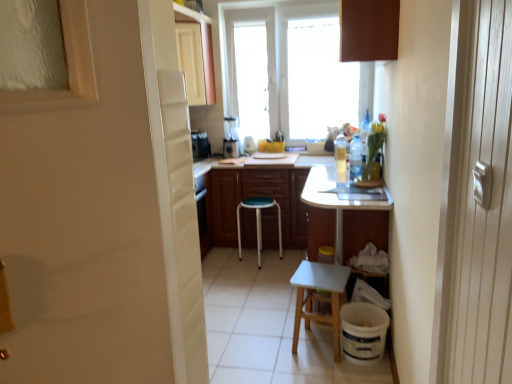
Identify the location of free space above brown matte cabinet at center, which appears as the 2th cabinetry when viewed from the right (from a real-world perspective). (273, 158).